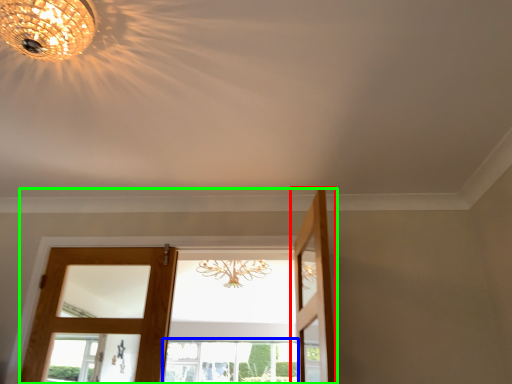
Question: Which object is the closest to the door (highlighted by a red box)? Choose among these: window (highlighted by a blue box) or door (highlighted by a green box).

Choices:
 (A) window
 (B) door

Answer: (B)